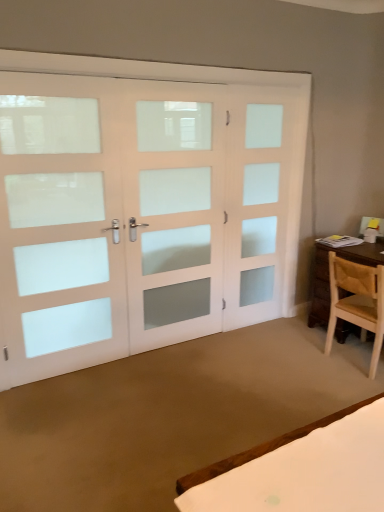
Image resolution: width=384 pixels, height=512 pixels. Find the location of `empty space that is ontop of white frosted glass door at right, which appears as the 3th screen door when viewed from the left (from a real-world perspective)`. empty space that is ontop of white frosted glass door at right, which appears as the 3th screen door when viewed from the left (from a real-world perspective) is located at coordinates (268, 82).